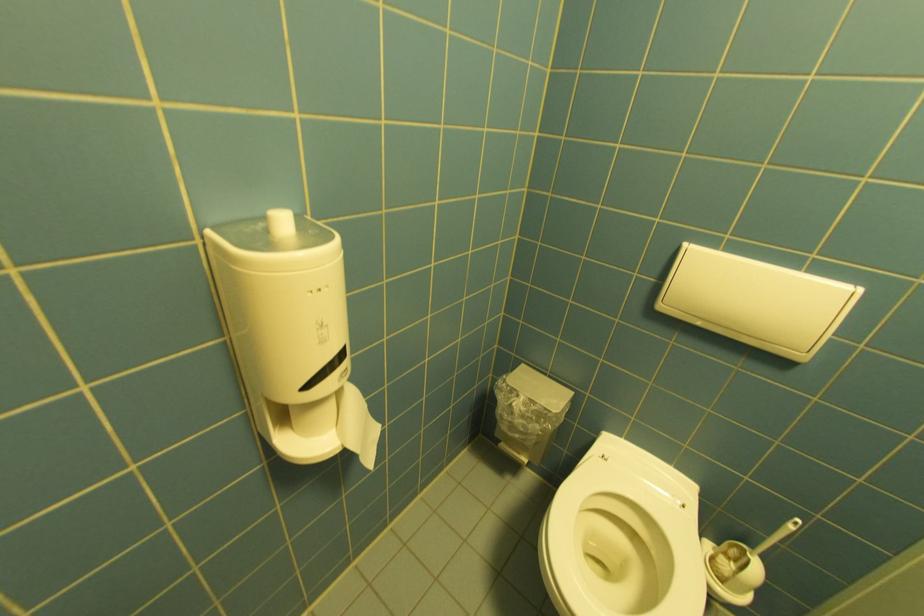
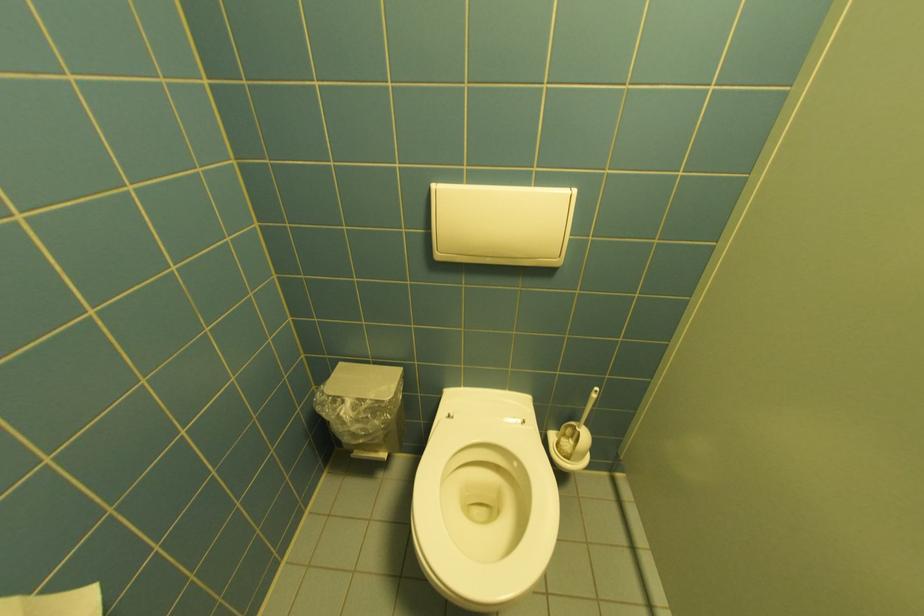
Locate, in the second image, the point that corresponds to (x=690, y=507) in the first image.

(529, 424)